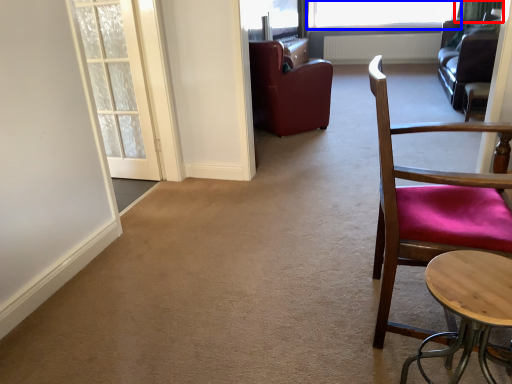
Question: Among these objects, which one is nearest to the camera, curtain (highlighted by a red box) or window (highlighted by a blue box)?

Choices:
 (A) curtain
 (B) window

Answer: (A)